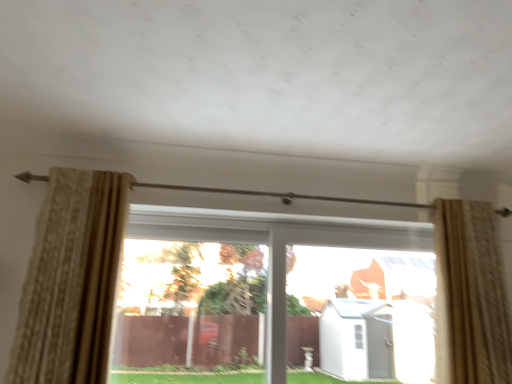
Question: Would you say transparent glass window at center, the first window when ordered from right to left, is part of beige textured curtain at left, the second curtain viewed from the right,'s contents?

Choices:
 (A) no
 (B) yes

Answer: (A)

Question: Does beige textured curtain at left, the first curtain viewed from the left, have a greater width compared to transparent glass window at center, the first window when ordered from right to left?

Choices:
 (A) yes
 (B) no

Answer: (A)

Question: Would you say beige textured curtain at left, the first curtain viewed from the left, is a long distance from transparent glass window at center, the first window when ordered from right to left?

Choices:
 (A) no
 (B) yes

Answer: (A)

Question: Is beige textured curtain at left, the second curtain viewed from the right, behind transparent glass window at center, the 2th window in the left-to-right sequence?

Choices:
 (A) no
 (B) yes

Answer: (A)

Question: Is beige textured curtain at left, the second curtain viewed from the right, taller than transparent glass window at center, the first window when ordered from right to left?

Choices:
 (A) yes
 (B) no

Answer: (A)

Question: From the image's perspective, is beige textured curtain at left, the first curtain viewed from the left, located beneath transparent glass window at center, the first window when ordered from right to left?

Choices:
 (A) no
 (B) yes

Answer: (A)

Question: Does beige textured curtain at right, the 2th curtain when ordered from left to right, have a smaller size compared to transparent glass window at center, the first window when ordered from right to left?

Choices:
 (A) no
 (B) yes

Answer: (A)

Question: Is beige textured curtain at right, the 2th curtain when ordered from left to right, surrounding transparent glass window at center, the 2th window in the left-to-right sequence?

Choices:
 (A) yes
 (B) no

Answer: (B)

Question: Does beige textured curtain at right, the 1th curtain in the right-to-left sequence, have a lesser height compared to transparent glass window at center, the first window when ordered from right to left?

Choices:
 (A) no
 (B) yes

Answer: (A)

Question: Does beige textured curtain at right, the 1th curtain in the right-to-left sequence, have a greater width compared to transparent glass window at center, the first window when ordered from right to left?

Choices:
 (A) yes
 (B) no

Answer: (A)

Question: Is beige textured curtain at right, the 1th curtain in the right-to-left sequence, at the right side of transparent glass window at center, the first window when ordered from right to left?

Choices:
 (A) yes
 (B) no

Answer: (A)

Question: From the image's perspective, does beige textured curtain at right, the 2th curtain when ordered from left to right, appear lower than transparent glass window at center, the first window when ordered from right to left?

Choices:
 (A) yes
 (B) no

Answer: (B)

Question: Can beige textured curtain at right, the 1th curtain in the right-to-left sequence, be found inside transparent glass window at center, the 1th window positioned from the left?

Choices:
 (A) yes
 (B) no

Answer: (B)